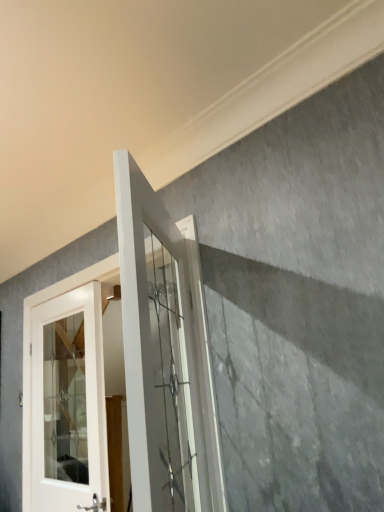
Question: From the image's perspective, relative to white glass door at left, which ranks as the 2th door in right-to-left order, is white glass door at center, which is counted as the 2th door, starting from the left, above or below?

Choices:
 (A) below
 (B) above

Answer: (B)

Question: Is white glass door at center, which is counted as the 2th door, starting from the left, in front of or behind white glass door at left, positioned as the 1th door in back-to-front order, in the image?

Choices:
 (A) behind
 (B) front

Answer: (B)

Question: Visually, is white glass door at center, which is counted as the 2th door, starting from the left, positioned to the left or to the right of white glass door at left, arranged as the 2th door when viewed from the front?

Choices:
 (A) right
 (B) left

Answer: (A)

Question: Based on their sizes in the image, would you say white glass door at left, arranged as the 2th door when viewed from the front, is bigger or smaller than white glass door at center, which is counted as the 2th door, starting from the left?

Choices:
 (A) big
 (B) small

Answer: (B)

Question: From the image's perspective, relative to white glass door at center, which is counted as the 2th door, starting from the back, is white glass door at left, positioned as the 1th door in back-to-front order, above or below?

Choices:
 (A) below
 (B) above

Answer: (A)

Question: Is point (79, 422) closer or farther from the camera than point (130, 185)?

Choices:
 (A) closer
 (B) farther

Answer: (B)

Question: In terms of width, does white glass door at left, arranged as the 2th door when viewed from the front, look wider or thinner when compared to white glass door at center, which is counted as the 2th door, starting from the left?

Choices:
 (A) wide
 (B) thin

Answer: (B)